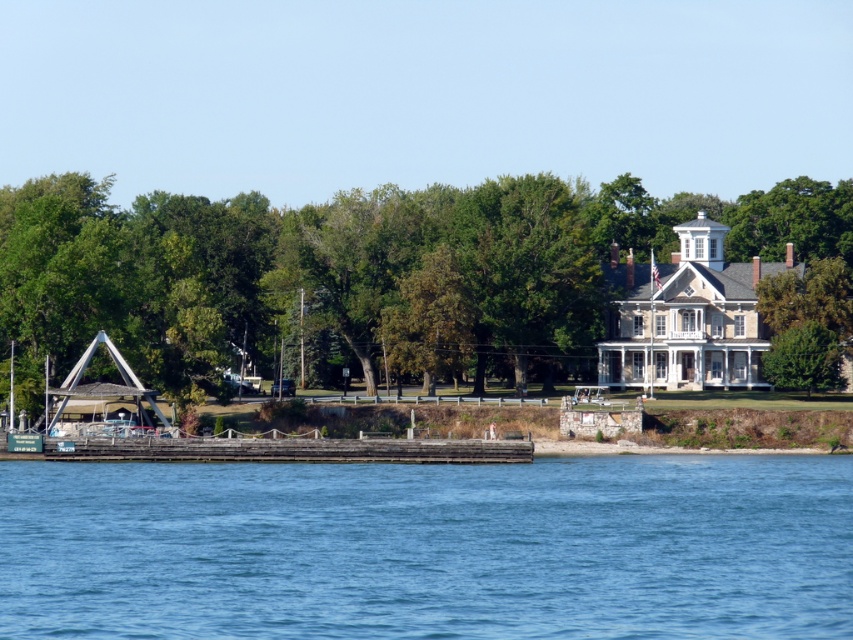
Which is behind, point (450, 525) or point (167, 442)?

Point (167, 442)

Where is `blue water at lower center`? blue water at lower center is located at coordinates (428, 548).

Which is in front, point (120, 474) or point (312, 456)?

Point (120, 474)

You are a GUI agent. You are given a task and a screenshot of the screen. Output one action in this format:
    pyautogui.click(x=<x>, y=<y>)
    Task: Click on the blue water at lower center
    This screenshot has width=853, height=640.
    Given the screenshot: What is the action you would take?
    pyautogui.click(x=428, y=548)

Is green leafy tree at upper center smaller than wooden dock at lower center?

No, green leafy tree at upper center is not smaller than wooden dock at lower center.

Does point (234, 216) lie in front of point (67, 451)?

No, (234, 216) is behind (67, 451).

Where is `green leafy tree at upper center`? The height and width of the screenshot is (640, 853). green leafy tree at upper center is located at coordinates (355, 269).

Is green leafy tree at upper center smaller than green leafy tree at center?

No.

Can you confirm if green leafy tree at upper center is bigger than green leafy tree at center?

Indeed, green leafy tree at upper center has a larger size compared to green leafy tree at center.

Is point (524, 380) positioned before point (778, 362)?

No, (524, 380) is behind (778, 362).

What are the coordinates of `green leafy tree at upper center` in the screenshot? It's located at (355, 269).